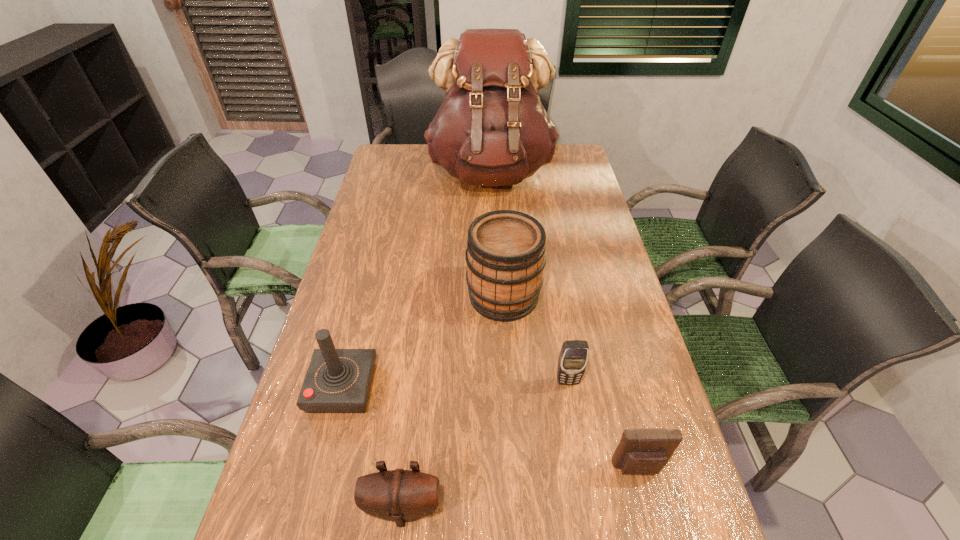
At what (x,y) coordinates should I click in order to perform the action: click on vacant space located 0.270m at the front of the farthest object with buckles. Please return your answer as a coordinate pair (x, y). The image size is (960, 540). Looking at the image, I should click on (493, 251).

Find the location of a particular element. free space located 0.140m on the left of the cider is located at coordinates [420, 296].

The image size is (960, 540). I want to click on free region located on the rectangular base of the joystick, so click(402, 388).

The image size is (960, 540). I want to click on free spot located 0.120m on the front face of the cellular telephone, so (x=576, y=433).

The image size is (960, 540). Find the location of `vacant space located 0.090m with an open flap on the fifth farthest object`. vacant space located 0.090m with an open flap on the fifth farthest object is located at coordinates (653, 526).

Find the location of a particular element. The width and height of the screenshot is (960, 540). object present at the far edge is located at coordinates click(x=491, y=129).

Find the location of a particular element. The width and height of the screenshot is (960, 540). object present at the left edge is located at coordinates (338, 380).

At what (x,y) coordinates should I click in order to perform the action: click on satchel located in the right edge section of the desktop. Please return your answer as a coordinate pair (x, y). The height and width of the screenshot is (540, 960). Looking at the image, I should click on (491, 129).

Image resolution: width=960 pixels, height=540 pixels. I want to click on pouch at the right edge, so [642, 451].

The width and height of the screenshot is (960, 540). I want to click on object present at the far right corner, so click(491, 129).